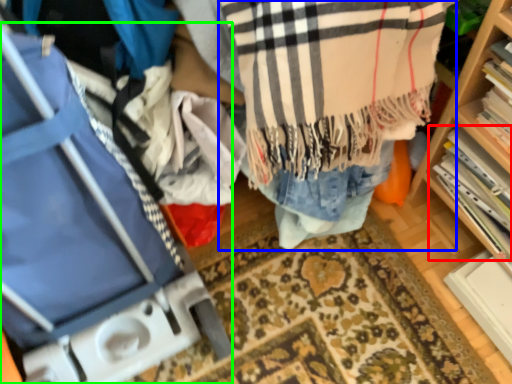
Question: Which is nearer to the book (highlighted by a red box)? clothing (highlighted by a blue box) or luggage (highlighted by a green box).

Choices:
 (A) clothing
 (B) luggage

Answer: (A)